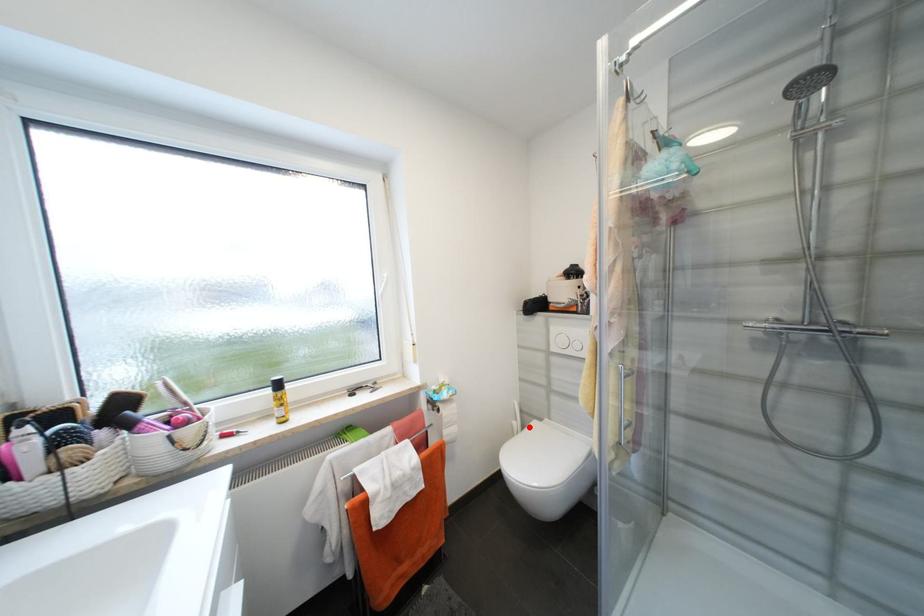
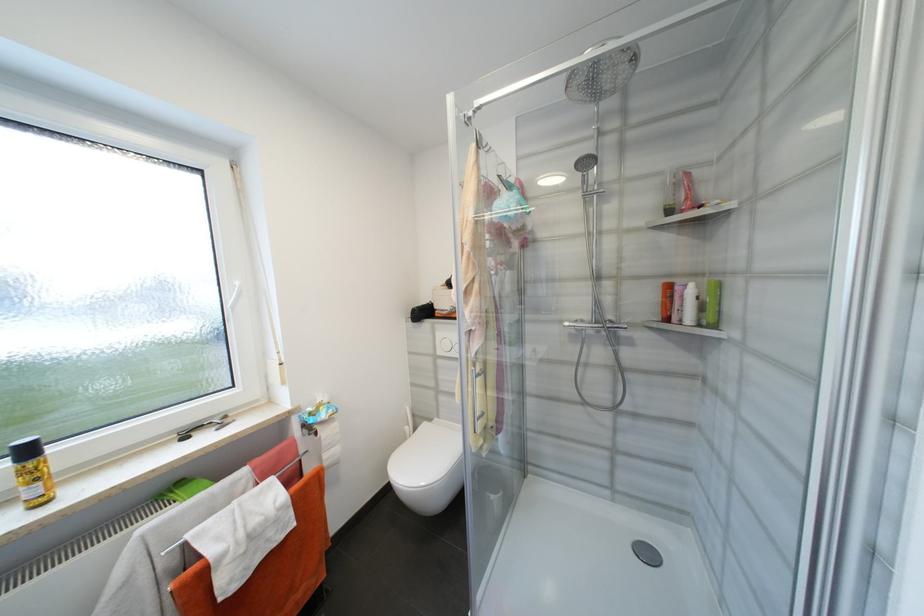
Question: I am providing you with two images of the same scene from different viewpoints. A red point is shown in image1. For the corresponding object point in image2, is it positioned nearer or farther from the camera?

Choices:
 (A) Nearer
 (B) Farther

Answer: (B)